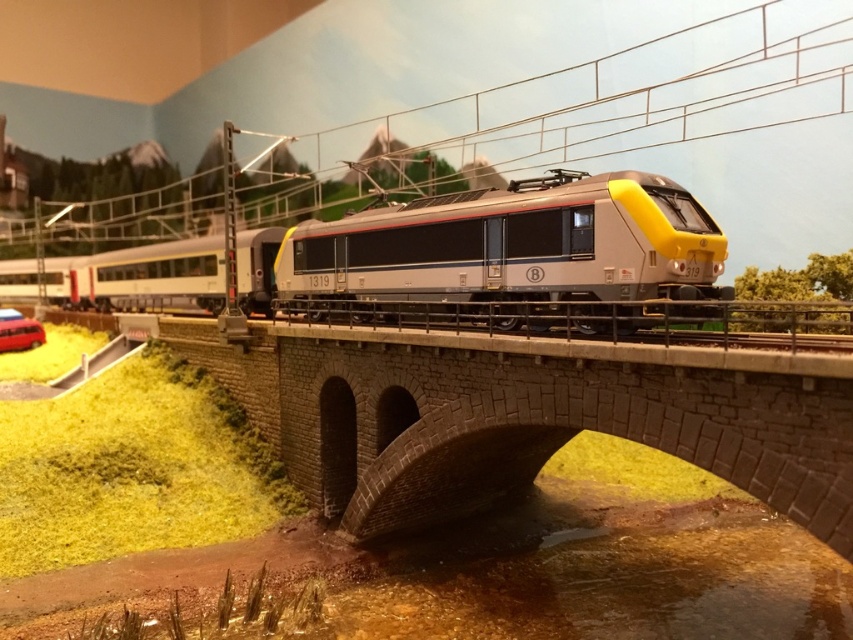
Question: Which point appears farthest from the camera in this image?

Choices:
 (A) (10, 324)
 (B) (637, 416)

Answer: (A)

Question: Can you confirm if stone bridge at center is positioned to the left of metallic silver train at center?

Choices:
 (A) yes
 (B) no

Answer: (B)

Question: Is stone bridge at center below matte red car at lower left?

Choices:
 (A) yes
 (B) no

Answer: (A)

Question: Which of the following is the farthest from the observer?

Choices:
 (A) metallic silver train at center
 (B) stone bridge at center

Answer: (A)

Question: Which is nearer to the matte red car at lower left?

Choices:
 (A) stone bridge at center
 (B) metallic silver train at center

Answer: (B)

Question: Does stone bridge at center appear on the right side of matte red car at lower left?

Choices:
 (A) no
 (B) yes

Answer: (B)